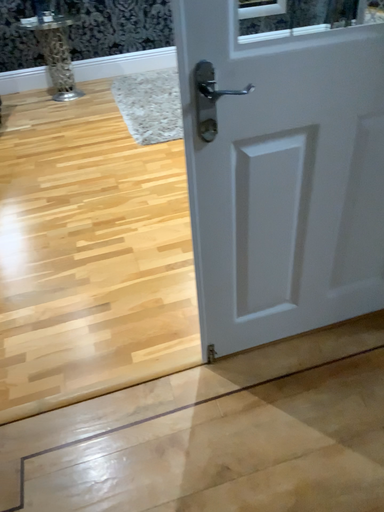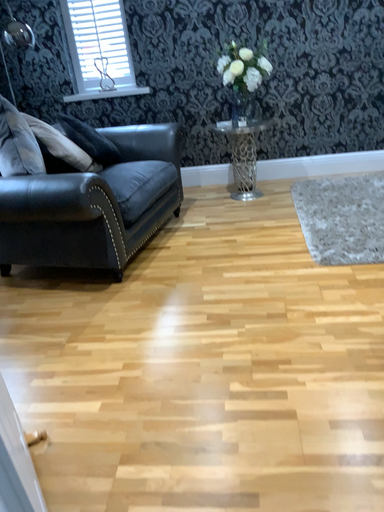
Question: Which way did the camera rotate in the video?

Choices:
 (A) rotated left
 (B) rotated right

Answer: (A)